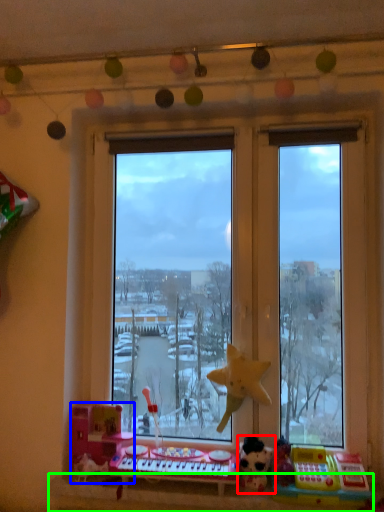
Question: Which is nearer to the toy (highlighted by a red box)? toy (highlighted by a blue box) or window sill (highlighted by a green box).

Choices:
 (A) toy
 (B) window sill

Answer: (B)